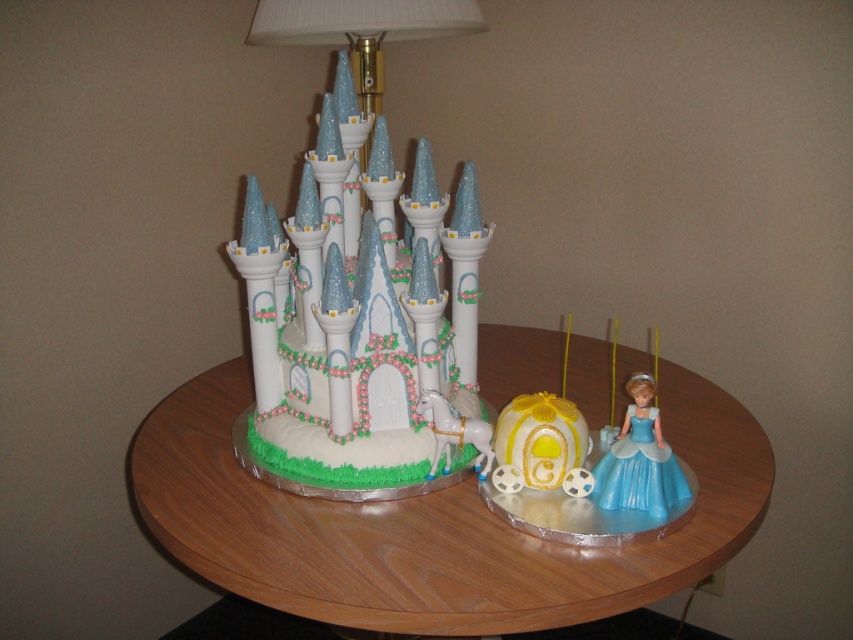
Question: Which of these objects is positioned farthest from the satin blue dress at lower right?

Choices:
 (A) wooden table at center
 (B) yellow fondant carriage at center
 (C) white fondant castle at center

Answer: (C)

Question: Which point is closer to the camera?

Choices:
 (A) (518, 461)
 (B) (683, 556)
 (C) (625, 506)

Answer: (B)

Question: Where is yellow fondant carriage at center located in relation to satin blue dress at lower right in the image?

Choices:
 (A) above
 (B) below

Answer: (B)

Question: Which of the following is the farthest from the observer?

Choices:
 (A) (668, 474)
 (B) (256, 426)
 (C) (519, 444)
 (D) (416, 536)

Answer: (B)

Question: Does wooden table at center have a lesser width compared to yellow fondant carriage at center?

Choices:
 (A) yes
 (B) no

Answer: (B)

Question: Does white fondant castle at center have a greater width compared to yellow fondant carriage at center?

Choices:
 (A) no
 (B) yes

Answer: (B)